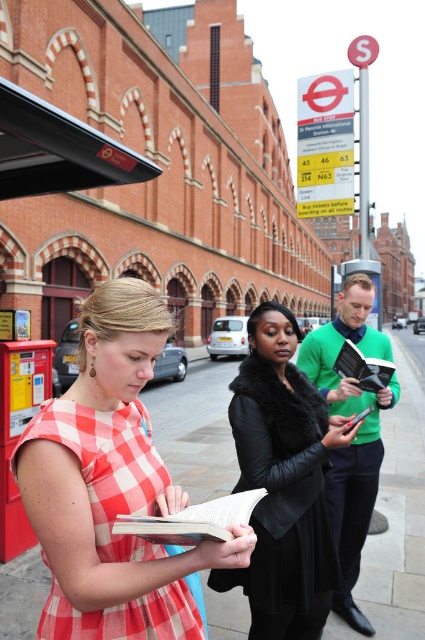
Question: Is white paper book at center smaller than leather-bound book at center?

Choices:
 (A) no
 (B) yes

Answer: (B)

Question: Can you confirm if black leather coat at center is positioned to the left of leather-bound book at center?

Choices:
 (A) no
 (B) yes

Answer: (B)

Question: Is paved stone sidewalk at center below black leather coat at center?

Choices:
 (A) no
 (B) yes

Answer: (B)

Question: Which object appears farthest from the camera in this image?

Choices:
 (A) black leather coat at center
 (B) leather-bound book at center
 (C) paved stone sidewalk at center

Answer: (C)

Question: Which point is farther to the camera?

Choices:
 (A) (340, 358)
 (B) (150, 536)
 (C) (388, 620)

Answer: (C)

Question: Which object is farther from the camera taking this photo?

Choices:
 (A) black leather coat at center
 (B) checkered fabric dress at lower left

Answer: (A)